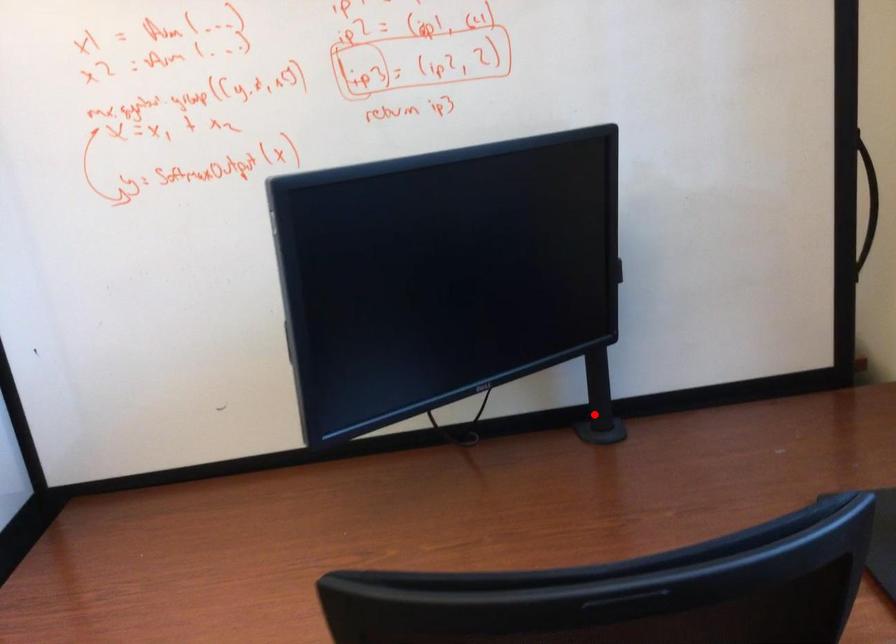
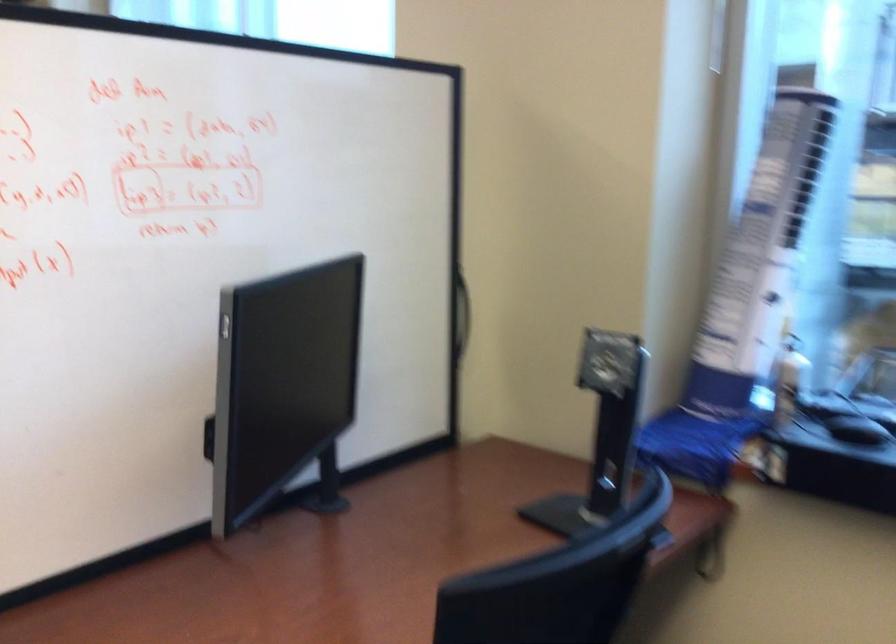
Locate, in the second image, the point that corresponds to the highlighted location in the first image.

(325, 487)